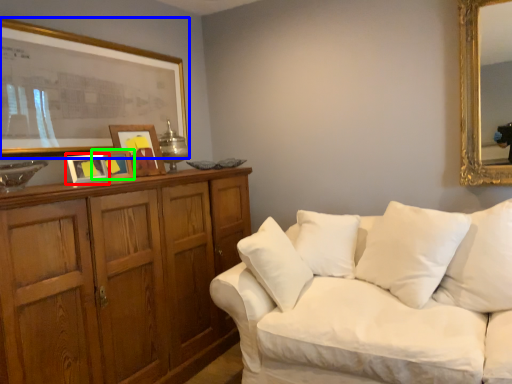
Question: Which object is the closest to the picture frame (highlighted by a red box)? Choose among these: picture frame (highlighted by a blue box) or picture frame (highlighted by a green box).

Choices:
 (A) picture frame
 (B) picture frame

Answer: (B)